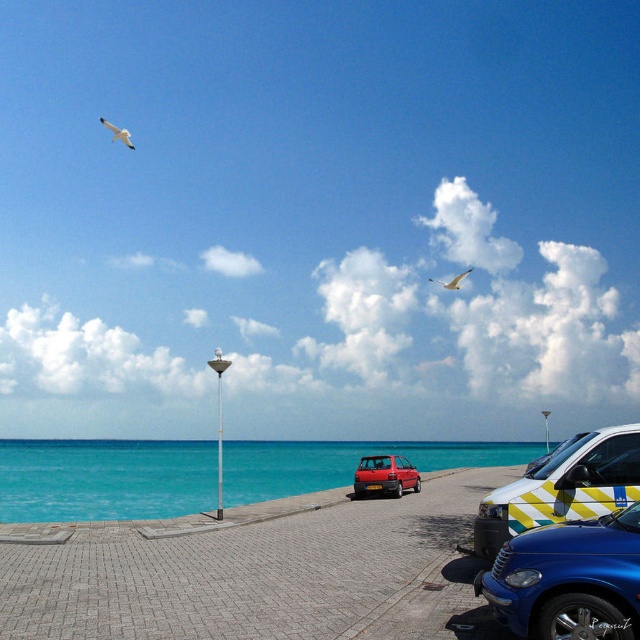
You are standing at point (x=484, y=588) and want to walk to point (x=38, y=461). Are you facing the sea or away from it?

Since point (x=38, y=461) is behind point (x=484, y=588), you are facing away from the sea when walking towards point (x=38, y=461).

You are a photographer trying to capture the blue glossy car at lower right and the white feathered bird at upper left in the same frame. Which object appears narrower in the photo?

The blue glossy car at lower right appears narrower than the white feathered bird at upper left in the photo.